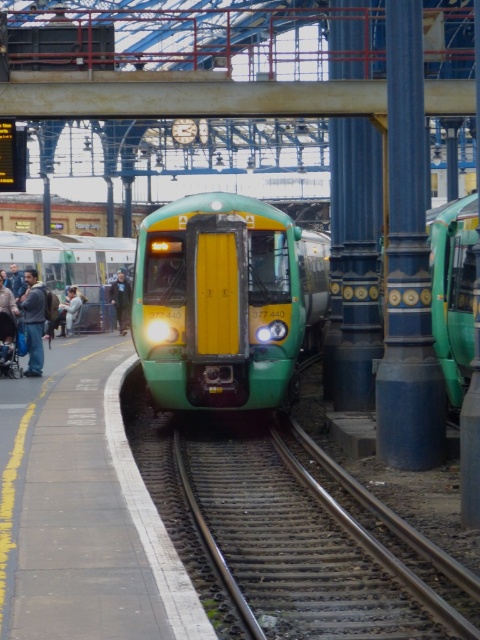
Question: Is blue polished metal pillar at center-right to the right of jeans at left from the viewer's perspective?

Choices:
 (A) yes
 (B) no

Answer: (A)

Question: Does blue painted metal pillar at right come in front of dark blue jeans at lower left?

Choices:
 (A) yes
 (B) no

Answer: (A)

Question: Which of the following is the farthest from the observer?

Choices:
 (A) (13, 348)
 (B) (62, 316)
 (C) (410, 588)
 (D) (38, 368)

Answer: (B)

Question: Which object appears closest to the camera in this image?

Choices:
 (A) light gray fabric jacket at left
 (B) dark blue jacket at left
 (C) blue painted metal pillar at right

Answer: (C)

Question: Which point appears farthest from the camera in this image?

Choices:
 (A) (69, 332)
 (B) (336, 397)

Answer: (A)

Question: Considering the relative positions of green matte train at right and light gray fabric jacket at left in the image provided, where is green matte train at right located with respect to light gray fabric jacket at left?

Choices:
 (A) left
 (B) right

Answer: (B)